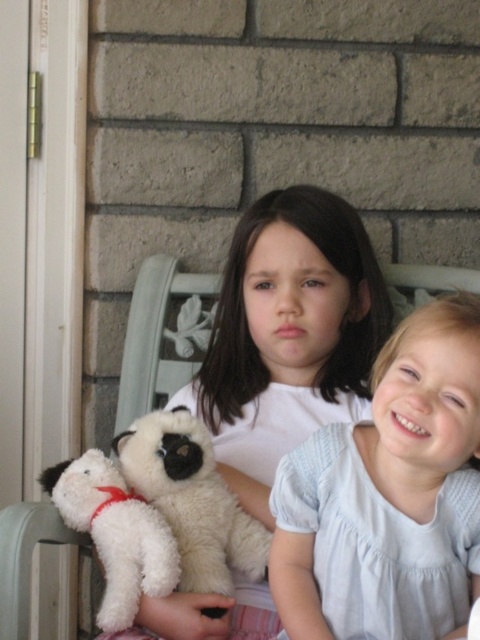
You are a photographer setting up for a family photo. You see the white cotton dress at center and the white plush dog at center in the frame. Which object is positioned to the right side of the other?

The white cotton dress at center is to the right of the white plush dog at center, so the dress is positioned to the right side of the dog.

You are a photographer setting up for a family photo. You need to ensure that the white cotton dress at center and the white plush dog at center are both visible in the frame. Given their sizes, which object should you position closer to the camera to maintain visibility?

The white plush dog at center is shorter than the white cotton dress at center, so positioning the white plush dog at center closer to the camera will help ensure both are visible in the frame.